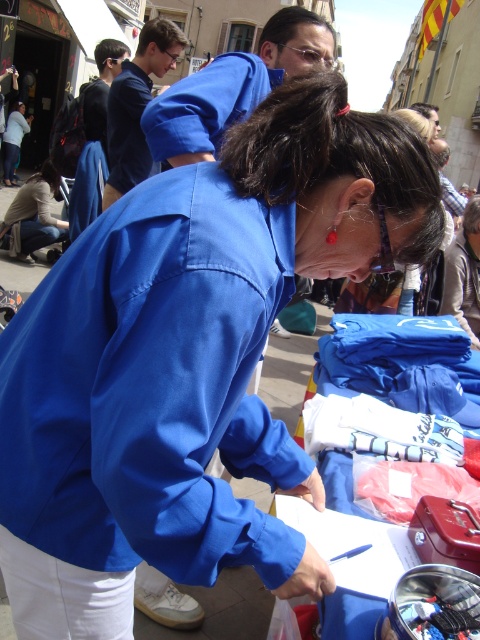
You are a tailor who needs to determine which item is shorter between the blue fabric shirt at upper center and the light brown leather jacket at lower left. Based on the scene, which one should you choose?

The blue fabric shirt at upper center is shorter than the light brown leather jacket at lower left, so you should choose the blue fabric shirt at upper center.

You are standing in the street scene and want to hand a donation to the person at the table. The red metal box on the table is where donations are placed. If you are 3 meters away from the blue fabric shirt at upper center, can you reach the red metal box on the table without moving closer?

The blue fabric shirt at upper center is 2.42 meters away from the camera. Since you are 3 meters away from it, the total distance from you to the red metal box on the table would be more than 2.42 meters. Therefore, you cannot reach the red metal box on the table without moving closer.

You are a photographer trying to capture the blue fabric shirt at upper center and the light brown leather jacket at lower left in the same frame. Based on their positions, which object should you focus on first to ensure both are in the frame?

The blue fabric shirt at upper center should be focused on first since it is located below the light brown leather jacket at lower left, meaning it is closer to the photographer. By focusing on the closer object first, both items will likely be in the frame.